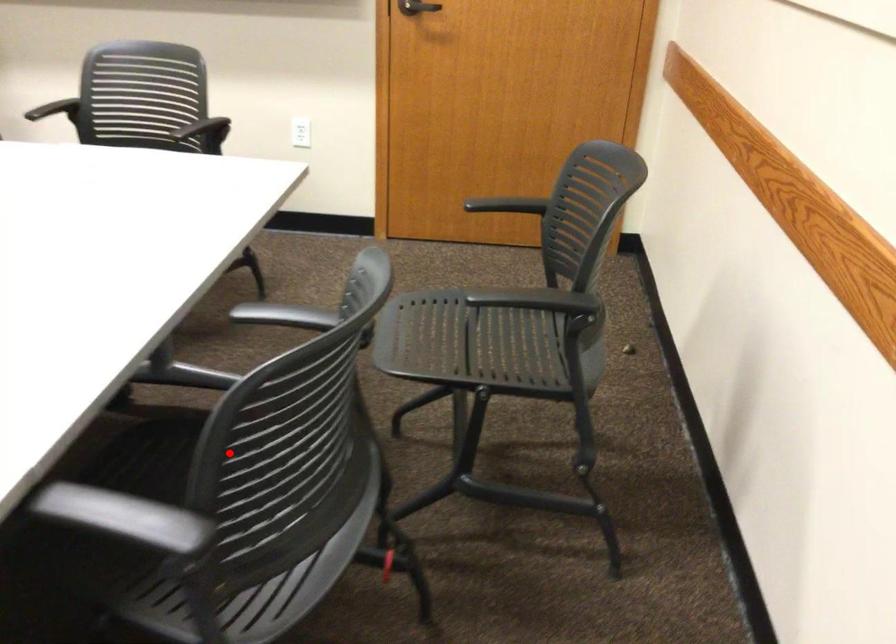
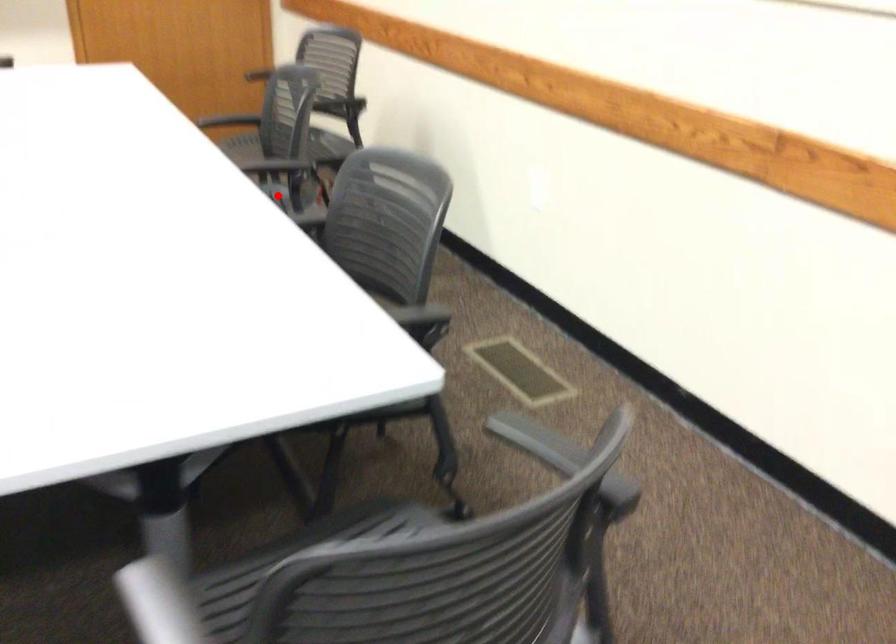
I am providing you with two images of the same scene from different viewpoints. A red point is marked on the first image and another point is marked on the second image. Is the marked point in image1 the same physical position as the marked point in image2?

No